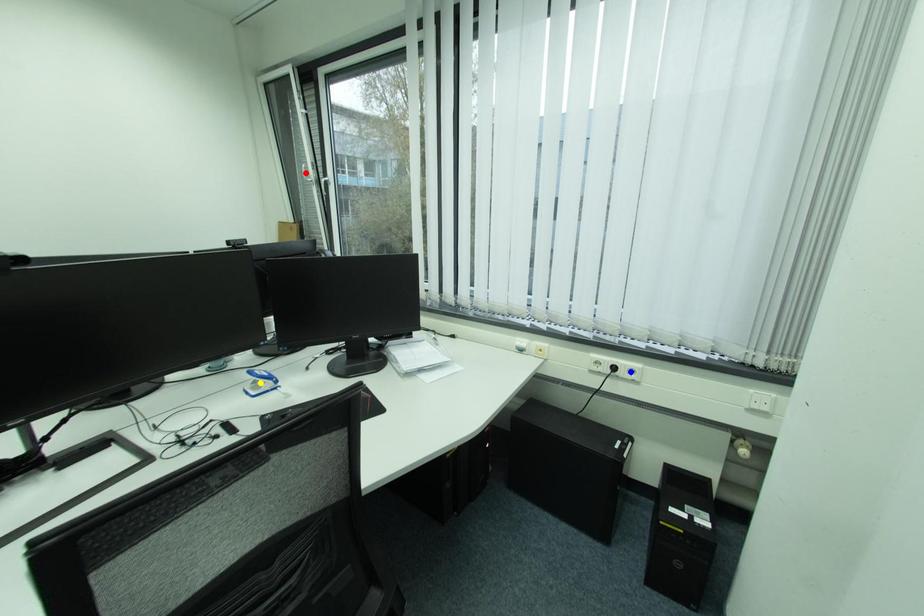
Consider the image. Order these from farthest to nearest:
red point | blue point | yellow point

red point → blue point → yellow point